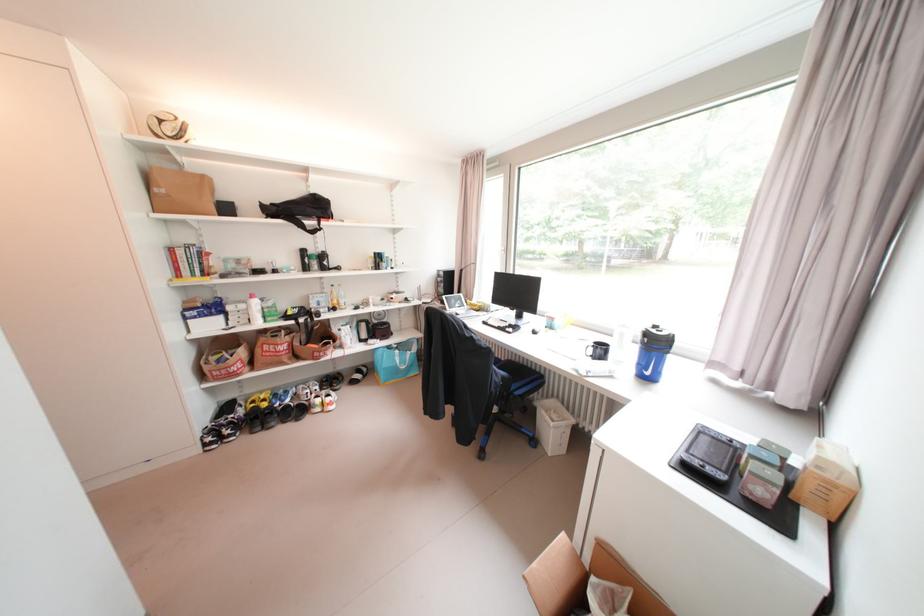
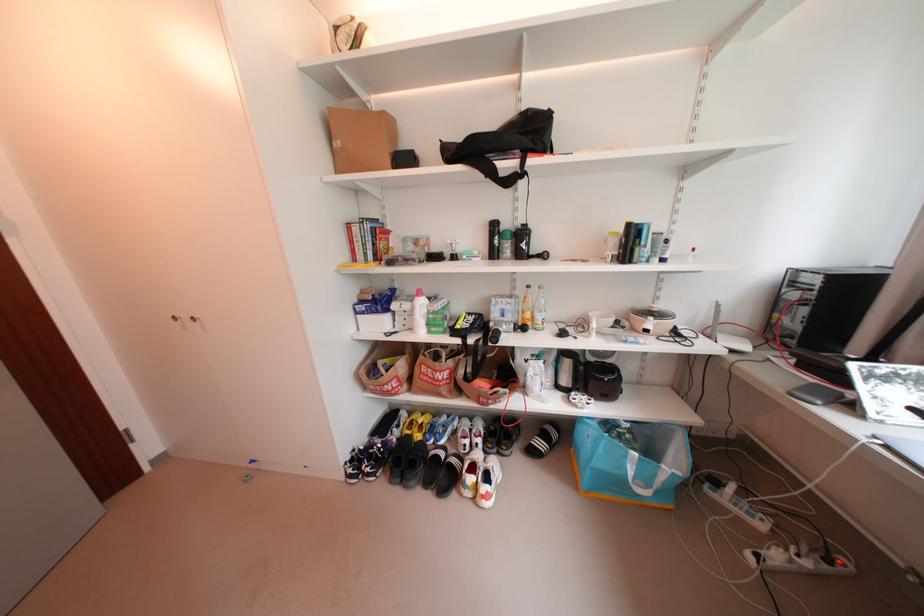
Find the pixel in the second image that matches (x=271, y=398) in the first image.

(429, 422)